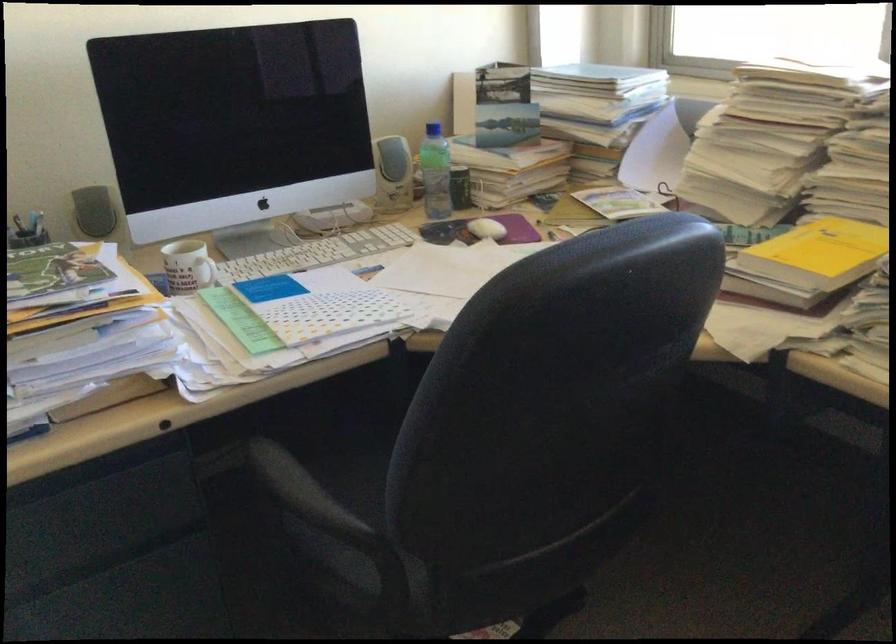
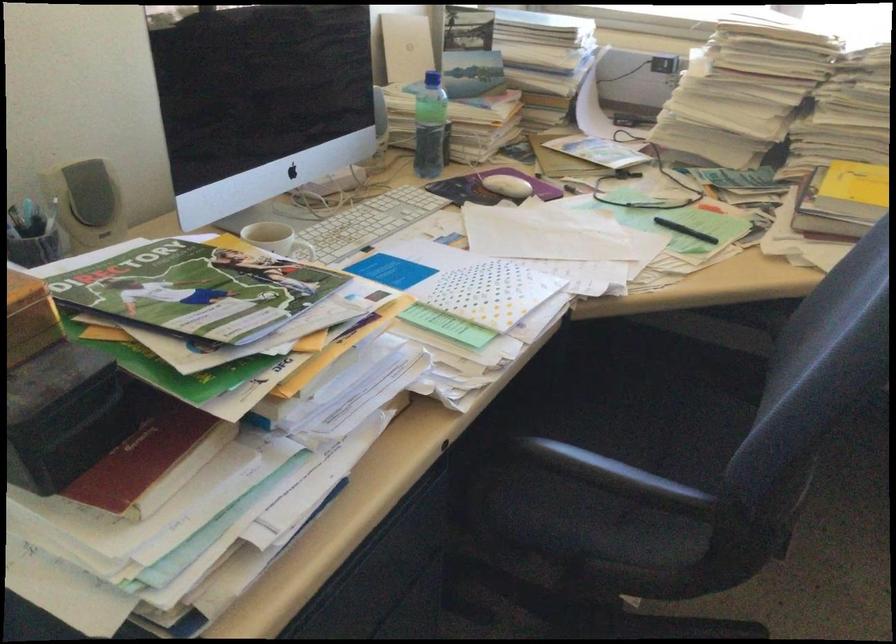
Locate, in the second image, the point that corresponds to pixel 779 252 in the first image.

(853, 194)